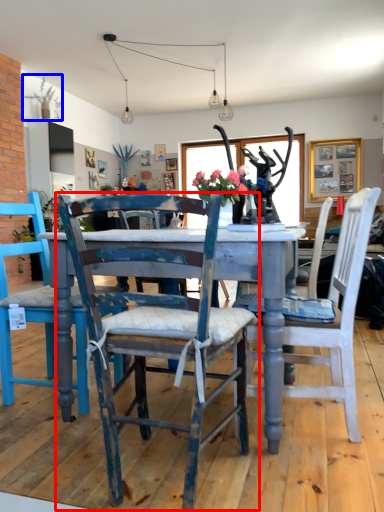
Question: Among these objects, which one is farthest to the camera, chair (highlighted by a red box) or plant (highlighted by a blue box)?

Choices:
 (A) chair
 (B) plant

Answer: (B)